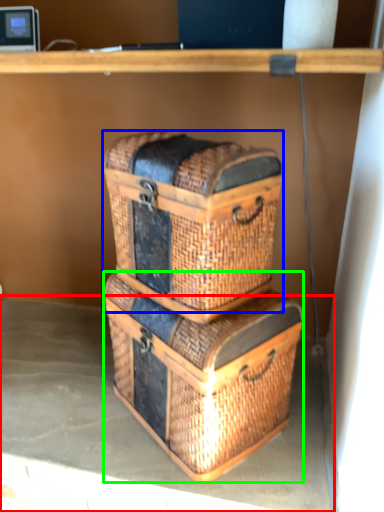
Question: Which object is the farthest from concrete (highlighted by a red box)? Choose among these: basket container (highlighted by a blue box) or crate (highlighted by a green box).

Choices:
 (A) basket container
 (B) crate

Answer: (A)